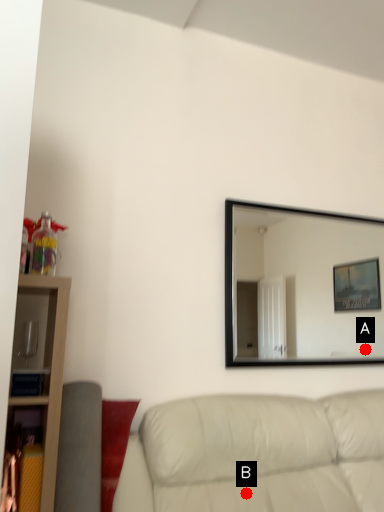
Question: Two points are circled on the image, labeled by A and B beside each circle. Which point is farther from the camera taking this photo?

Choices:
 (A) A is further
 (B) B is further

Answer: (A)